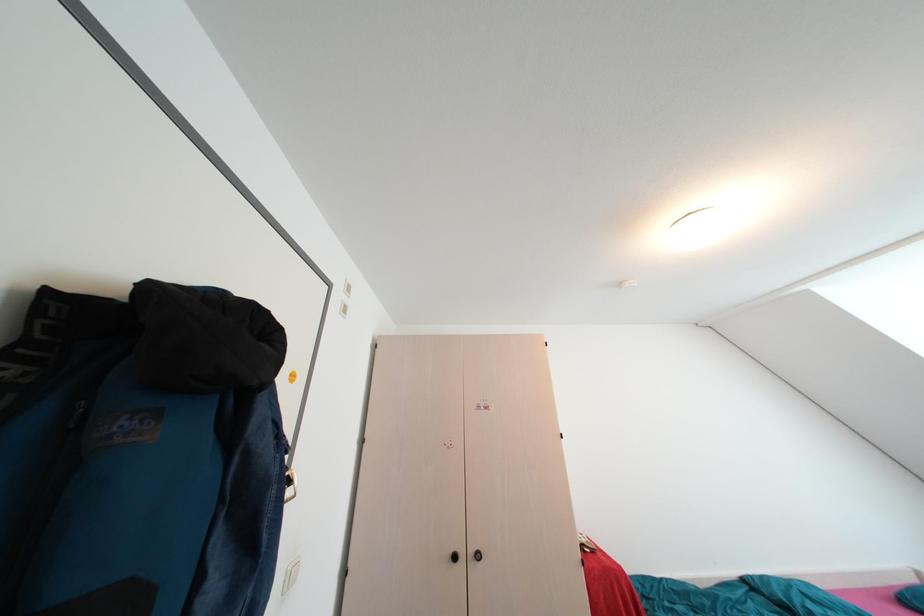
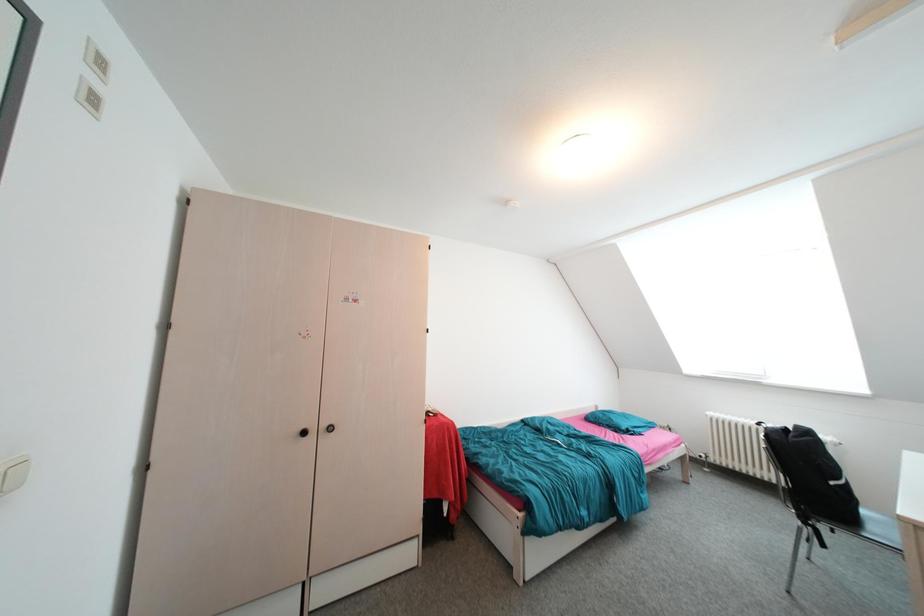
Question: The first image is from the beginning of the video and the second image is from the end. How did the camera likely rotate when shooting the video?

Choices:
 (A) Left
 (B) Right
 (C) Up
 (D) Down

Answer: (B)